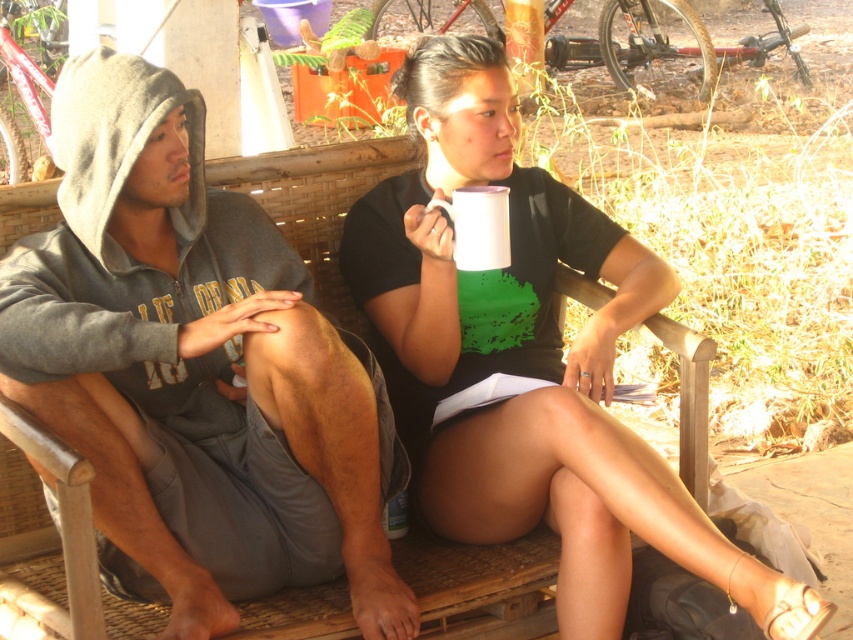
Question: Can you confirm if gray fleece hoodie at left is thinner than white matte cup at center?

Choices:
 (A) no
 (B) yes

Answer: (B)

Question: Can you confirm if gray fleece hoodie at left is thinner than white matte cup at center?

Choices:
 (A) no
 (B) yes

Answer: (B)

Question: Among these objects, which one is nearest to the camera?

Choices:
 (A) white matte cup at center
 (B) gray fleece hoodie at left

Answer: (A)

Question: Can you confirm if gray fleece hoodie at left is smaller than white matte cup at center?

Choices:
 (A) yes
 (B) no

Answer: (A)

Question: Which of the following is the farthest from the observer?

Choices:
 (A) (79, 248)
 (B) (476, 397)

Answer: (B)

Question: Among these objects, which one is nearest to the camera?

Choices:
 (A) gray fleece hoodie at left
 (B) white matte cup at center

Answer: (B)